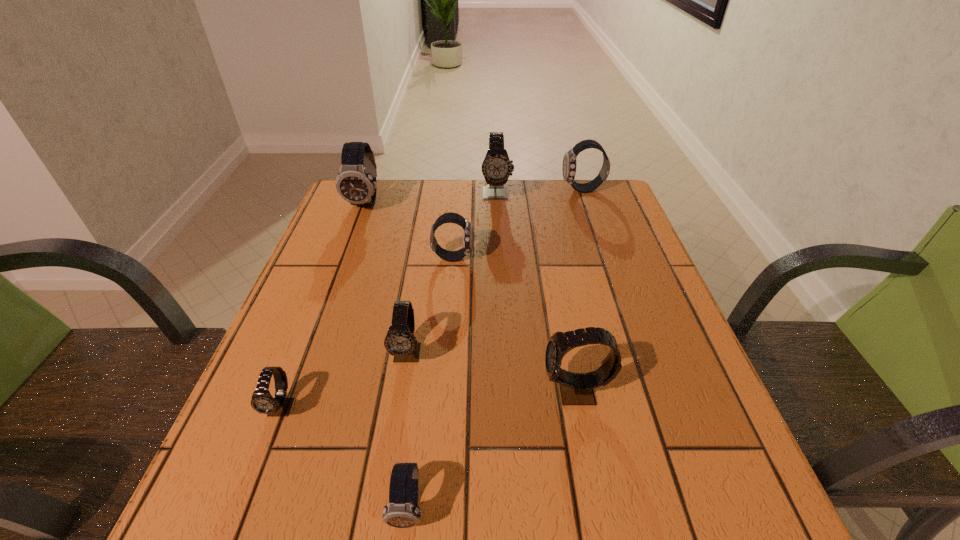
Locate an element on the screen. free point at the near edge is located at coordinates pos(458,536).

In the image, there is a desktop. At what (x,y) coordinates should I click in order to perform the action: click on free space at the left edge. Please return your answer as a coordinate pair (x, y). The height and width of the screenshot is (540, 960). Looking at the image, I should click on (367, 261).

The height and width of the screenshot is (540, 960). In the image, there is a desktop. Find the location of `vacant space at the right edge`. vacant space at the right edge is located at coordinates (626, 404).

Identify the location of vacant space at the far left corner of the desktop. The image size is (960, 540). click(373, 210).

The image size is (960, 540). What are the coordinates of `free space at the far right corner of the desktop` in the screenshot? It's located at (576, 218).

At what (x,y) coordinates should I click in order to perform the action: click on vacant area that lies between the fourth farthest watch and the seventh watch from left to right. Please return your answer as a coordinate pair (x, y). Looking at the image, I should click on (515, 325).

Find the location of a particular element. unoccupied position between the second biggest dark watch and the rightmost gray watch is located at coordinates (579, 291).

I want to click on free space between the second smallest gray watch and the rightmost watch, so pos(495,272).

What are the coordinates of `empty space that is in between the nearest dark watch and the fifth nearest watch` in the screenshot? It's located at (431, 382).

The height and width of the screenshot is (540, 960). What are the coordinates of `vacant region between the third watch from right to left and the second object from right to left` in the screenshot? It's located at (536, 293).